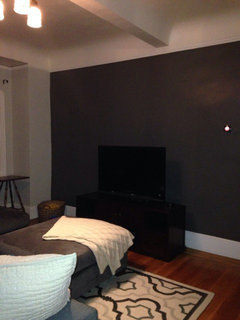
Where is `laundry wicker basket`? The height and width of the screenshot is (320, 240). laundry wicker basket is located at coordinates (53, 210), (44, 211).